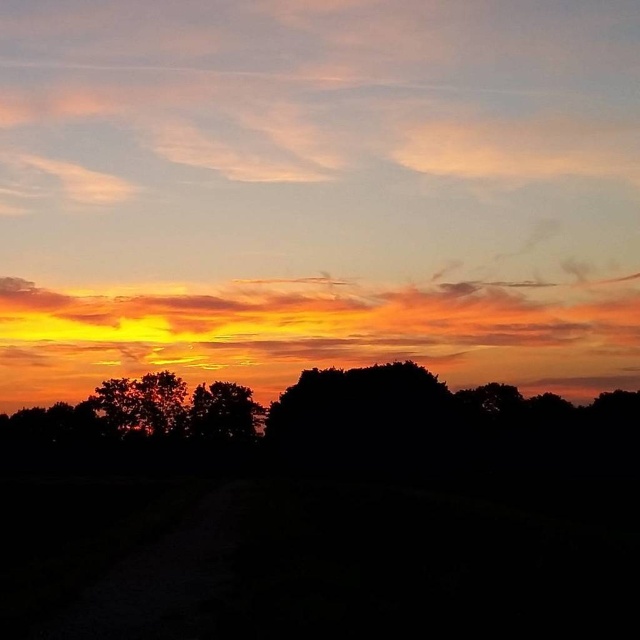
Is point (93, 209) positioned in front of point (246, 417)?

No, it is behind (246, 417).

Does orange translucent cloud at upper center have a greater height compared to silhouette tree at center?

Yes, orange translucent cloud at upper center is taller than silhouette tree at center.

Which is behind, point (536, 323) or point (209, 419)?

The point (536, 323) is behind.

At what (x,y) coordinates should I click in order to perform the action: click on orange translucent cloud at upper center. Please return your answer as a coordinate pair (x, y). Looking at the image, I should click on (317, 193).